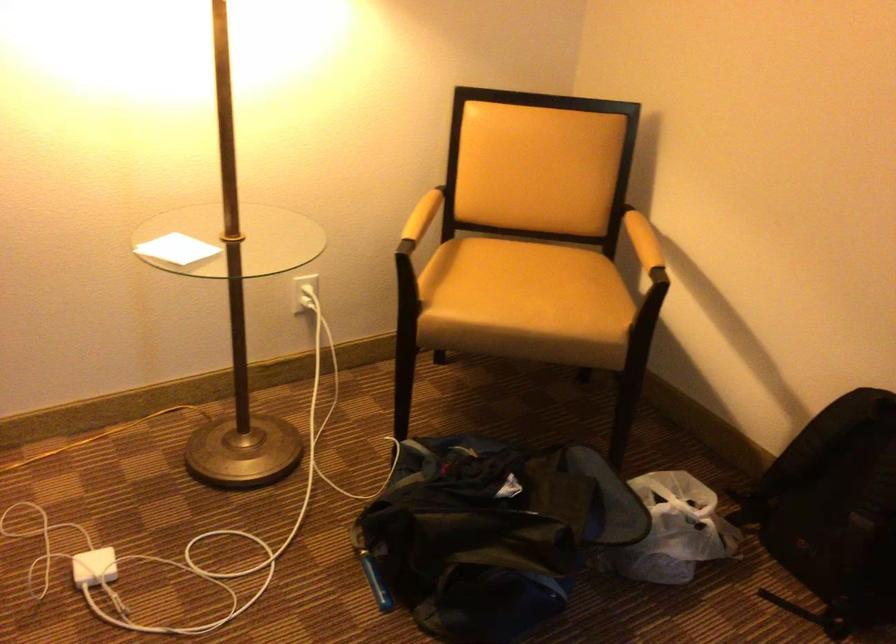
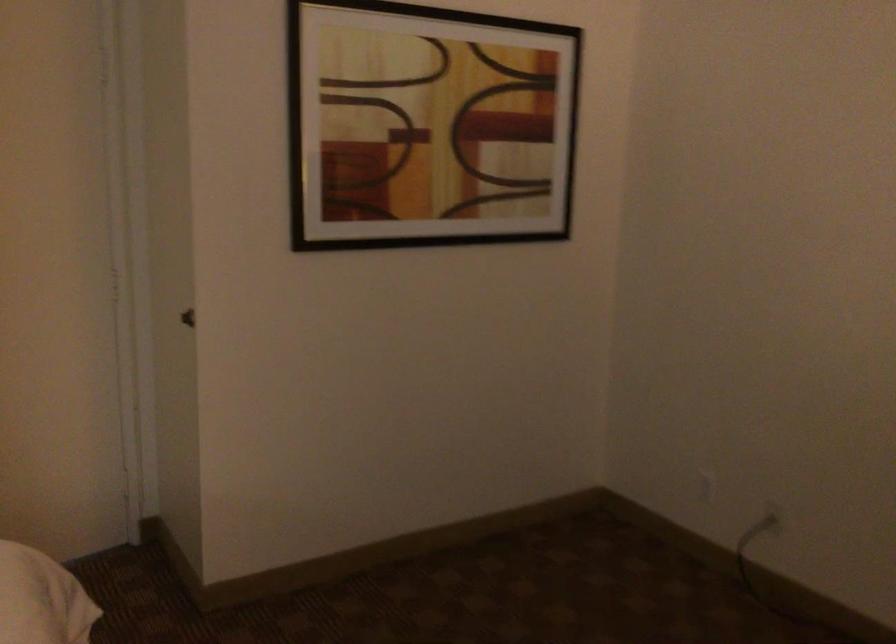
Question: The images are taken continuously from a first-person perspective. In which direction is your viewpoint rotating?

Choices:
 (A) Left
 (B) Right
 (C) Up
 (D) Down

Answer: (A)